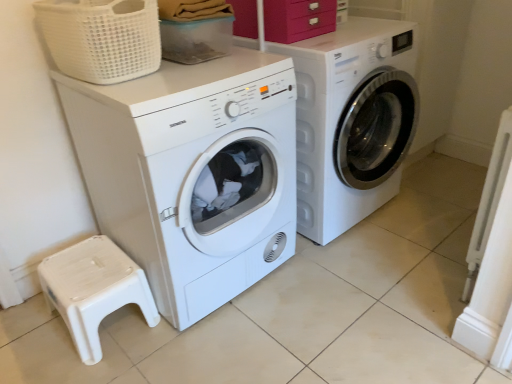
Locate an element on the screen. This screenshot has height=384, width=512. vacant region to the right of white matte washing machine at left, which ranks as the first washing machine in left-to-right order is located at coordinates tap(354, 291).